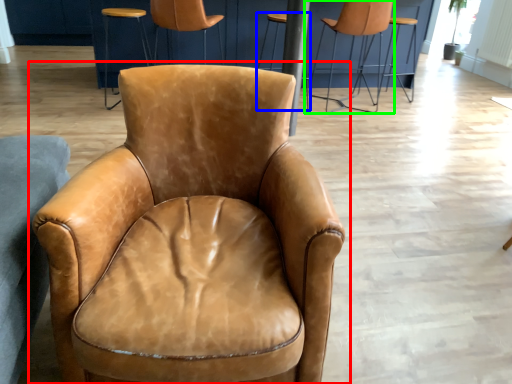
Question: Which object is the farthest from chair (highlighted by a red box)? Choose among these: bar stool (highlighted by a blue box) or chair (highlighted by a green box).

Choices:
 (A) bar stool
 (B) chair

Answer: (B)